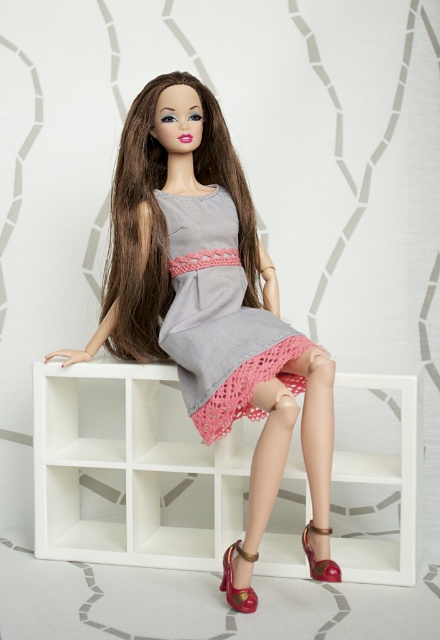
Question: Where is matte gray dress at center located in relation to shiny red leather sandal at lower right in the image?

Choices:
 (A) below
 (B) above

Answer: (B)

Question: Which of these objects is positioned farthest from the matte gray dress at center?

Choices:
 (A) gray fabric dress at center
 (B) shiny red leather sandal at lower right

Answer: (B)

Question: Which of the following is the farthest from the observer?

Choices:
 (A) (215, 212)
 (B) (178, 278)
 (C) (72, 424)

Answer: (C)

Question: Based on their relative distances, which object is nearer to the gray fabric dress at center?

Choices:
 (A) shiny gold sandal at lower center
 (B) matte gray dress at center

Answer: (B)

Question: Is gray fabric dress at center to the right of shiny red leather sandal at lower right from the viewer's perspective?

Choices:
 (A) yes
 (B) no

Answer: (B)

Question: Is matte gray dress at center further to camera compared to gray fabric dress at center?

Choices:
 (A) yes
 (B) no

Answer: (B)